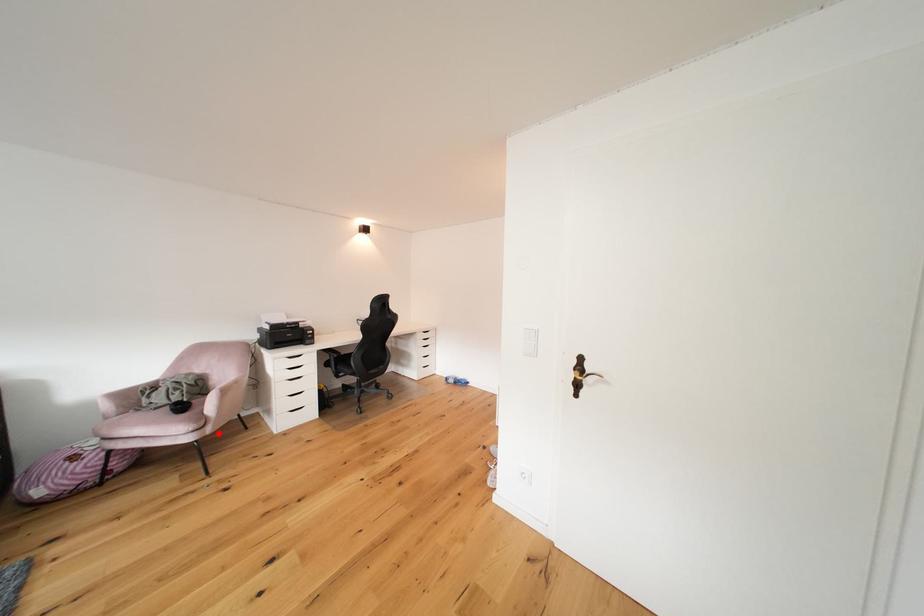
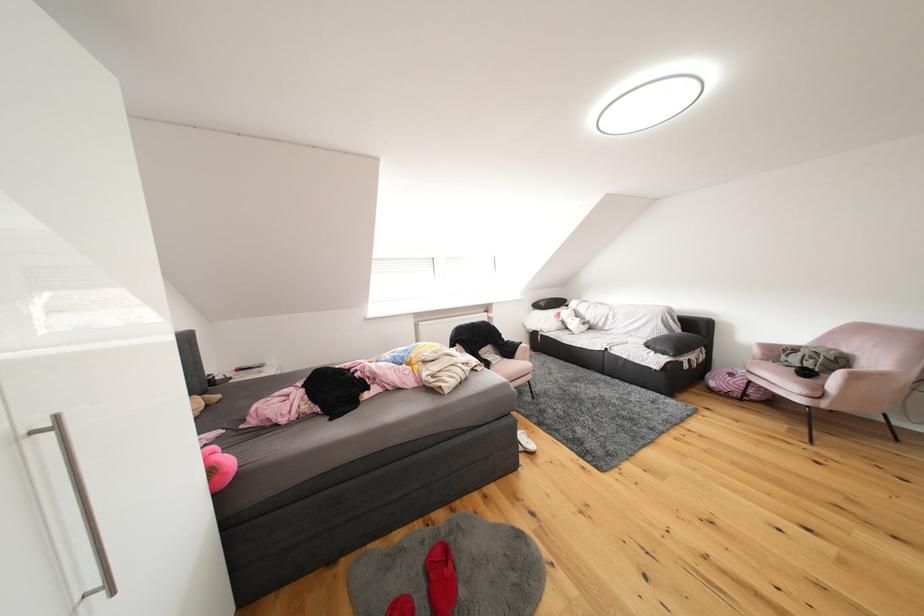
Question: I am providing you with two images of the same scene from different viewpoints. Image1 has a red point marked. In image2, the corresponding 3D location appears at what relative position? Reply with the corresponding letter.

Choices:
 (A) Closer
 (B) Farther

Answer: (A)